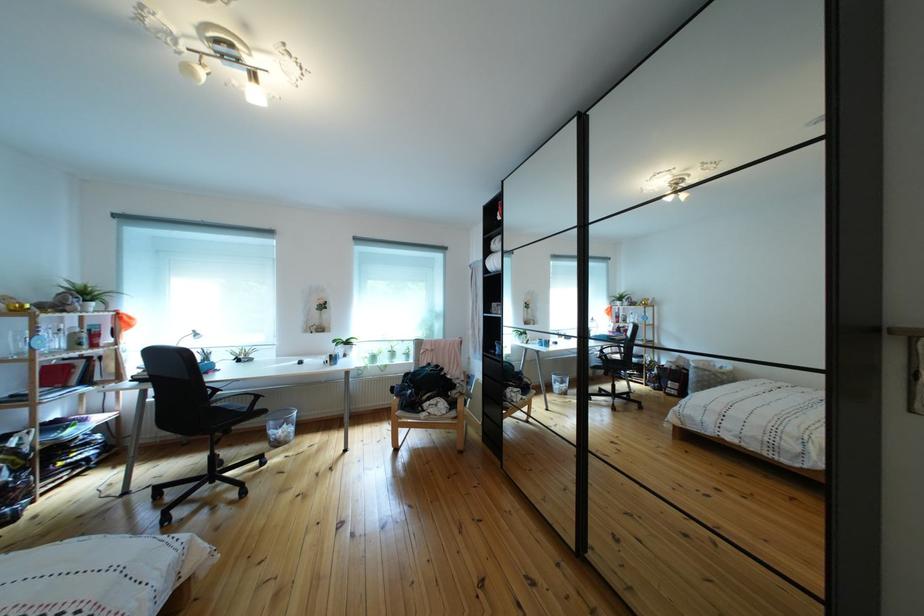
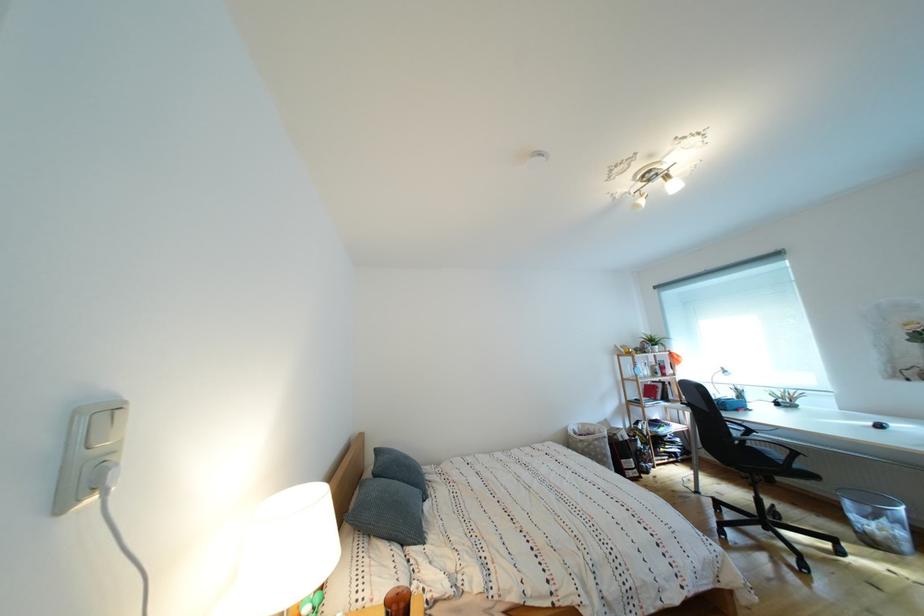
Where in the second image is the point corresponding to (297,431) from the first image?

(896, 527)